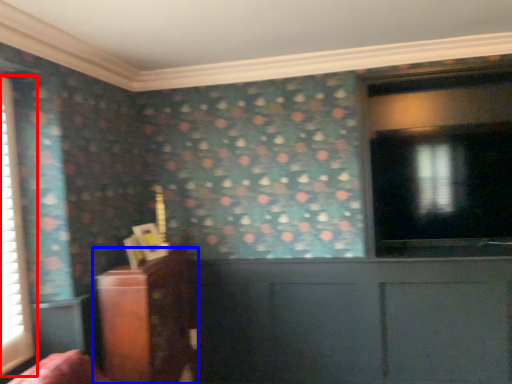
Question: Which point is further to the camera, window (highlighted by a red box) or furniture (highlighted by a blue box)?

Choices:
 (A) window
 (B) furniture

Answer: (B)